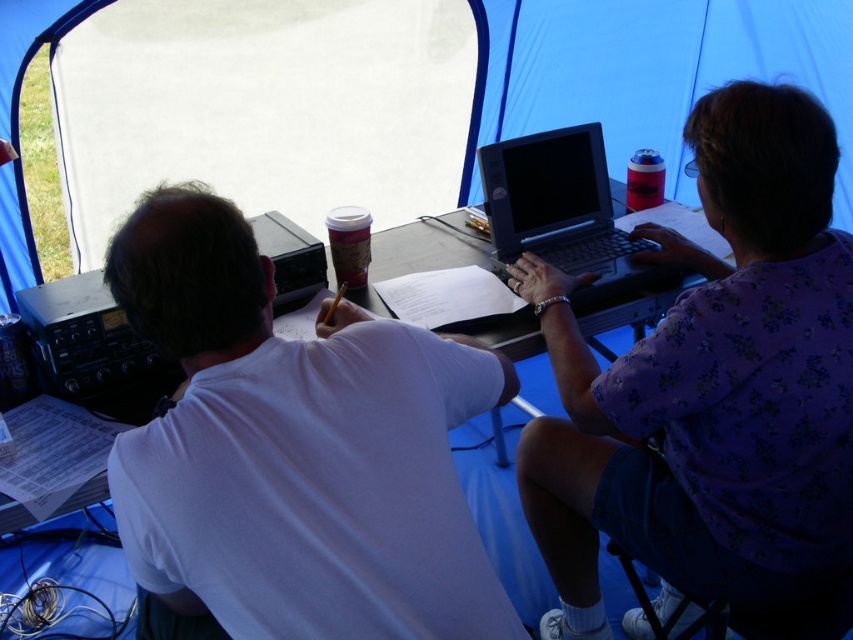
Question: Does white matte shirt at center appear under brown paper cup at center?

Choices:
 (A) no
 (B) yes

Answer: (B)

Question: Among these objects, which one is farthest from the camera?

Choices:
 (A) matte black laptop at center
 (B) purple floral shirt at center
 (C) blue fabric tent at upper center
 (D) white matte shirt at center

Answer: (C)

Question: Does white matte shirt at center appear over blue fabric tent at upper center?

Choices:
 (A) yes
 (B) no

Answer: (B)

Question: Can you confirm if blue fabric tent at upper center is positioned below brown paper cup at center?

Choices:
 (A) no
 (B) yes

Answer: (A)

Question: Which point is closer to the camera?

Choices:
 (A) (843, 426)
 (B) (351, 212)
 (C) (636, 192)

Answer: (A)

Question: Estimate the real-world distances between objects in this image. Which object is closer to the matte plastic cup at upper right?

Choices:
 (A) purple floral shirt at center
 (B) brown paper cup at center

Answer: (A)